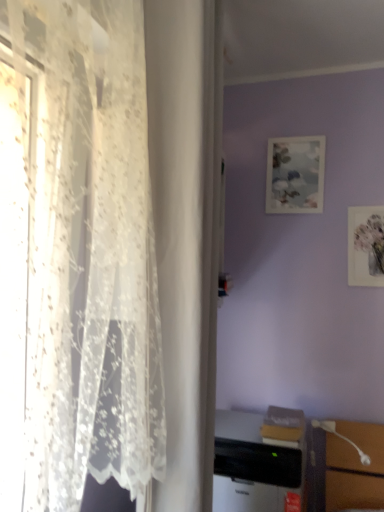
This screenshot has height=512, width=384. Find the location of `matte paper picture frame at upper center, the second picture frame when ordered from bottom to top`. matte paper picture frame at upper center, the second picture frame when ordered from bottom to top is located at coordinates (295, 175).

The image size is (384, 512). Describe the element at coordinates (341, 438) in the screenshot. I see `white glossy table lamp at lower right` at that location.

This screenshot has height=512, width=384. I want to click on black plastic desktop computer at lower center, so click(255, 467).

Measure the distance between black plastic desktop computer at lower center and camera.

The depth of black plastic desktop computer at lower center is 1.41 meters.

The width and height of the screenshot is (384, 512). Identify the location of matte paper picture frame at upper center, the first picture frame when ordered from back to front. (295, 175).

Is point (252, 496) closer or farther from the camera than point (304, 156)?

Point (252, 496) appears to be closer to the viewer than point (304, 156).

Is black plastic desktop computer at lower center facing away from matte paper picture frame at upper center, which ranks as the second picture frame in front-to-back order?

black plastic desktop computer at lower center is not turned away from matte paper picture frame at upper center, which ranks as the second picture frame in front-to-back order.

How many degrees apart are the facing directions of black plastic desktop computer at lower center and matte paper picture frame at upper center, the first picture frame when ordered from back to front?

1.31 degrees.

Is black plastic desktop computer at lower center wider or thinner than matte paper picture frame at upper center, the first picture frame when ordered from back to front?

black plastic desktop computer at lower center is wider than matte paper picture frame at upper center, the first picture frame when ordered from back to front.

How much distance is there between matte paper picture frame at upper right, the 1th picture frame viewed from the front, and matte paper picture frame at upper center, the second picture frame when ordered from bottom to top?

matte paper picture frame at upper right, the 1th picture frame viewed from the front, and matte paper picture frame at upper center, the second picture frame when ordered from bottom to top, are 11.02 inches apart.

How different are the orientations of matte paper picture frame at upper right, arranged as the first picture frame when viewed from the right, and matte paper picture frame at upper center, which ranks as the second picture frame in front-to-back order, in degrees?

0.0161 degrees.

From a real-world perspective, which is physically below, matte paper picture frame at upper right, arranged as the first picture frame when viewed from the right, or matte paper picture frame at upper center, which ranks as the second picture frame in front-to-back order?

matte paper picture frame at upper right, arranged as the first picture frame when viewed from the right.

Do you think matte paper picture frame at upper right, the 1th picture frame viewed from the front, is within matte paper picture frame at upper center, which is the first picture frame from top to bottom, or outside of it?

The correct answer is: outside.

Can you see black plastic desktop computer at lower center touching matte paper picture frame at upper right, marked as the 1th picture frame in a bottom-to-top arrangement?

No, black plastic desktop computer at lower center is not in contact with matte paper picture frame at upper right, marked as the 1th picture frame in a bottom-to-top arrangement.

Can you tell me how much black plastic desktop computer at lower center and matte paper picture frame at upper right, the 1th picture frame viewed from the front, differ in facing direction?

There is a 1.31-degree angle between the facing directions of black plastic desktop computer at lower center and matte paper picture frame at upper right, the 1th picture frame viewed from the front.

Is black plastic desktop computer at lower center inside or outside of matte paper picture frame at upper right, the 2th picture frame positioned from the top?

black plastic desktop computer at lower center cannot be found inside matte paper picture frame at upper right, the 2th picture frame positioned from the top.

I want to click on desktop computer that is in front of the matte paper picture frame at upper right, which ranks as the 2th picture frame in back-to-front order, so click(255, 467).

Is matte paper picture frame at upper center, which is counted as the first picture frame, starting from the left, positioned with its back to matte paper picture frame at upper right, the 2th picture frame positioned from the top?

No, matte paper picture frame at upper center, which is counted as the first picture frame, starting from the left, is not facing away from matte paper picture frame at upper right, the 2th picture frame positioned from the top.

Is matte paper picture frame at upper center, the second picture frame when ordered from bottom to top, to the right of matte paper picture frame at upper right, which ranks as the 2th picture frame in back-to-front order, from the viewer's perspective?

Incorrect, matte paper picture frame at upper center, the second picture frame when ordered from bottom to top, is not on the right side of matte paper picture frame at upper right, which ranks as the 2th picture frame in back-to-front order.

From the image's perspective, is matte paper picture frame at upper center, which is the first picture frame from top to bottom, above matte paper picture frame at upper right, arranged as the first picture frame when viewed from the right?

Yes.

Locate an element on the screen. This screenshot has height=512, width=384. picture frame above the matte paper picture frame at upper right, the 1th picture frame viewed from the front (from a real-world perspective) is located at coordinates (295, 175).

You are a GUI agent. You are given a task and a screenshot of the screen. Output one action in this format:
    pyautogui.click(x=<x>, y=<y>)
    Task: Click on the desktop computer that is in front of the matte paper picture frame at upper center, which is counted as the first picture frame, starting from the left
    The height and width of the screenshot is (512, 384).
    Given the screenshot: What is the action you would take?
    pyautogui.click(x=255, y=467)

Can you confirm if matte paper picture frame at upper center, the second picture frame when ordered from bottom to top, is positioned to the right of black plastic desktop computer at lower center?

Correct, you'll find matte paper picture frame at upper center, the second picture frame when ordered from bottom to top, to the right of black plastic desktop computer at lower center.

Is matte paper picture frame at upper center, which is counted as the first picture frame, starting from the left, placed right next to black plastic desktop computer at lower center?

They are not placed beside each other.

Is point (316, 194) closer or farther from the camera than point (286, 478)?

Point (316, 194) is farther from the camera than point (286, 478).

Is white glossy table lamp at lower right surrounding matte paper picture frame at upper right, the 2th picture frame positioned from the top?

Actually, matte paper picture frame at upper right, the 2th picture frame positioned from the top, is outside white glossy table lamp at lower right.

From the image's perspective, which one is positioned higher, white glossy table lamp at lower right or matte paper picture frame at upper right, arranged as the first picture frame when viewed from the right?

matte paper picture frame at upper right, arranged as the first picture frame when viewed from the right, from the image's perspective.

Relative to matte paper picture frame at upper right, the 1th picture frame viewed from the front, is white glossy table lamp at lower right in front or behind?

Clearly, white glossy table lamp at lower right is in front of matte paper picture frame at upper right, the 1th picture frame viewed from the front.

Would you consider white glossy table lamp at lower right to be distant from matte paper picture frame at upper right, which is counted as the 2th picture frame, starting from the left?

No, white glossy table lamp at lower right is in close proximity to matte paper picture frame at upper right, which is counted as the 2th picture frame, starting from the left.

Does white glossy table lamp at lower right lie behind black plastic desktop computer at lower center?

Yes, it is.

Which point is more forward, [332,422] or [266,442]?

The point [266,442] is closer to the camera.

Is black plastic desktop computer at lower center located within white glossy table lamp at lower right?

A: No, black plastic desktop computer at lower center is not inside white glossy table lamp at lower right.

Where is `table lamp above the black plastic desktop computer at lower center (from the image's perspective)`? This screenshot has height=512, width=384. table lamp above the black plastic desktop computer at lower center (from the image's perspective) is located at coordinates coord(341,438).

At what (x,y) coordinates should I click in order to perform the action: click on the 2nd picture frame above the black plastic desktop computer at lower center (from a real-world perspective). Please return your answer as a coordinate pair (x, y). This screenshot has height=512, width=384. Looking at the image, I should click on (295, 175).

The height and width of the screenshot is (512, 384). Identify the location of picture frame directly beneath the matte paper picture frame at upper center, the first picture frame when ordered from back to front (from a real-world perspective). (366, 246).

When comparing their distances from white glossy table lamp at lower right, does matte paper picture frame at upper right, which is counted as the 2th picture frame, starting from the left, or matte paper picture frame at upper center, the second picture frame when ordered from bottom to top, seem further?

matte paper picture frame at upper center, the second picture frame when ordered from bottom to top, is further to white glossy table lamp at lower right.

Considering their positions, is matte paper picture frame at upper center, which ranks as the second picture frame in front-to-back order, positioned closer to white glossy table lamp at lower right than matte paper picture frame at upper right, marked as the 1th picture frame in a bottom-to-top arrangement?

matte paper picture frame at upper right, marked as the 1th picture frame in a bottom-to-top arrangement, is closer to white glossy table lamp at lower right.

Estimate the real-world distances between objects in this image. Which object is further from white glossy table lamp at lower right, matte paper picture frame at upper right, which is counted as the 2th picture frame, starting from the left, or black plastic desktop computer at lower center?

Based on the image, matte paper picture frame at upper right, which is counted as the 2th picture frame, starting from the left, appears to be further to white glossy table lamp at lower right.

Looking at the image, which one is located closer to white glossy table lamp at lower right, black plastic desktop computer at lower center or matte paper picture frame at upper center, the 2th picture frame from the right?

black plastic desktop computer at lower center is positioned closer to the anchor white glossy table lamp at lower right.

When comparing their distances from black plastic desktop computer at lower center, does matte paper picture frame at upper center, which is counted as the first picture frame, starting from the left, or matte paper picture frame at upper right, which ranks as the 2th picture frame in back-to-front order, seem closer?

matte paper picture frame at upper right, which ranks as the 2th picture frame in back-to-front order, is positioned closer to the anchor black plastic desktop computer at lower center.

Estimate the real-world distances between objects in this image. Which object is further from white glossy table lamp at lower right, black plastic desktop computer at lower center or matte paper picture frame at upper right, arranged as the first picture frame when viewed from the right?

The object further to white glossy table lamp at lower right is matte paper picture frame at upper right, arranged as the first picture frame when viewed from the right.

Which object lies nearer to the anchor point matte paper picture frame at upper right, the 2th picture frame positioned from the top, matte paper picture frame at upper center, which ranks as the second picture frame in front-to-back order, or white glossy table lamp at lower right?

Based on the image, matte paper picture frame at upper center, which ranks as the second picture frame in front-to-back order, appears to be nearer to matte paper picture frame at upper right, the 2th picture frame positioned from the top.

Based on their spatial positions, is matte paper picture frame at upper center, the 2th picture frame from the right, or white glossy table lamp at lower right closer to black plastic desktop computer at lower center?

Based on the image, white glossy table lamp at lower right appears to be nearer to black plastic desktop computer at lower center.

At what (x,y) coordinates should I click in order to perform the action: click on table lamp that lies between matte paper picture frame at upper center, the 2th picture frame from the right, and black plastic desktop computer at lower center from top to bottom. Please return your answer as a coordinate pair (x, y). The image size is (384, 512). Looking at the image, I should click on (341, 438).

Locate an element on the screen. This screenshot has height=512, width=384. picture frame that lies between matte paper picture frame at upper center, which ranks as the second picture frame in front-to-back order, and black plastic desktop computer at lower center from top to bottom is located at coordinates point(366,246).

This screenshot has width=384, height=512. What are the coordinates of `picture frame between matte paper picture frame at upper center, which ranks as the second picture frame in front-to-back order, and white glossy table lamp at lower right, in the vertical direction` in the screenshot? It's located at (366, 246).

Find the location of a particular element. table lamp between matte paper picture frame at upper right, marked as the 1th picture frame in a bottom-to-top arrangement, and black plastic desktop computer at lower center vertically is located at coordinates (341, 438).